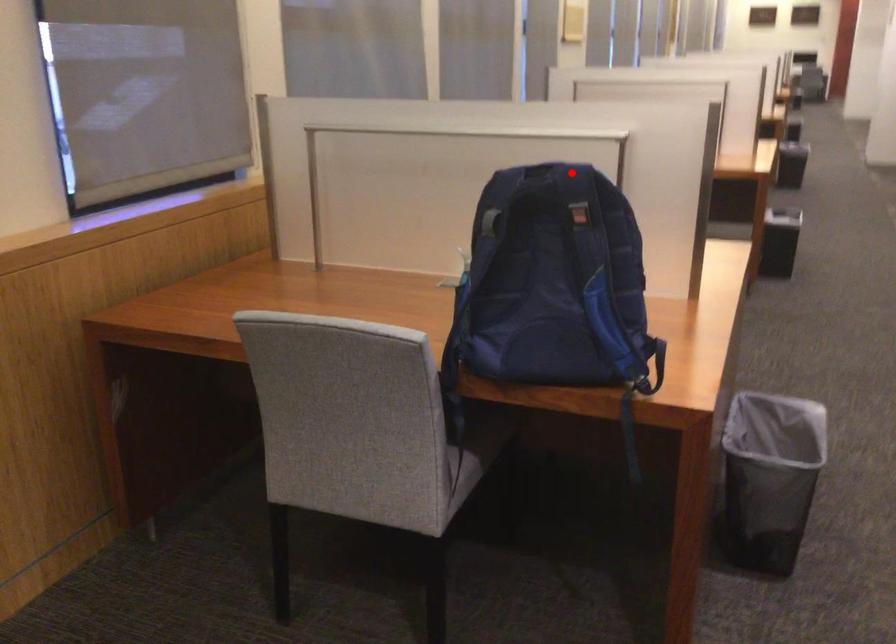
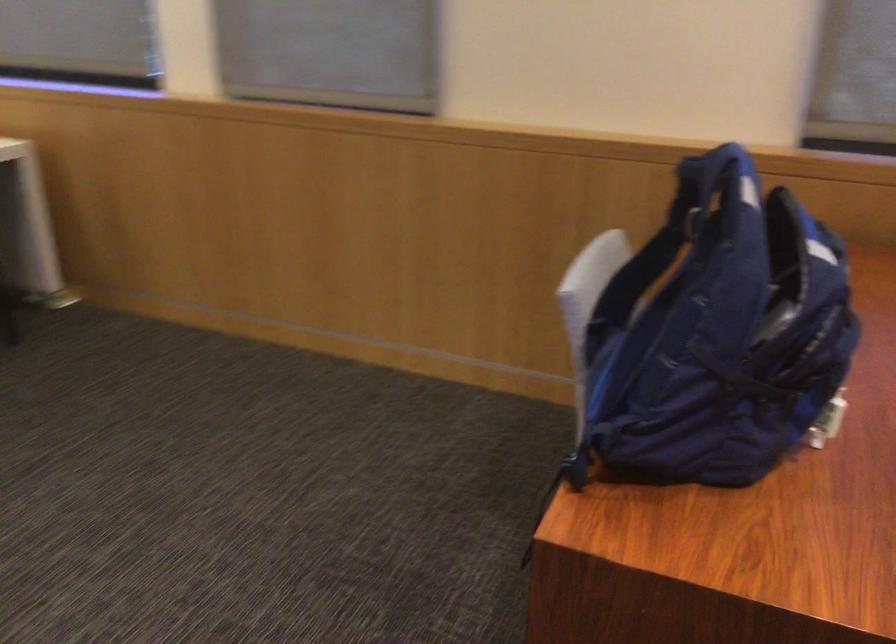
Locate, in the second image, the point that corresponds to the highlighted location in the first image.

(730, 178)